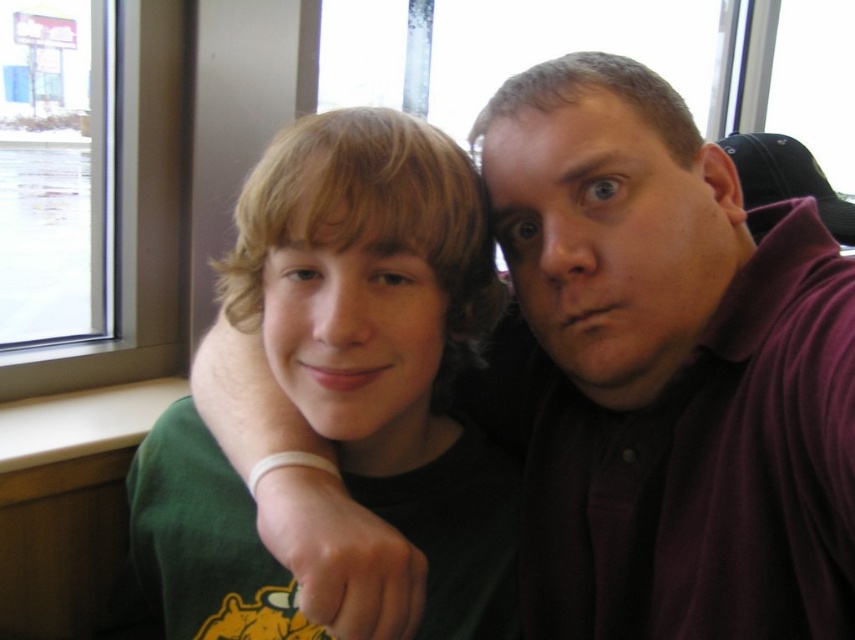
In the scene shown: You are a social distancing enforcer in a public space. You observe two people sitting at point (358, 268). What is the minimum distance you should enforce between them to comply with a 6 feet social distancing guideline?

The minimum distance required for compliance is 6 feet, which is 72 inches. Since the two individuals are only 23.66 inches apart, they are not compliant. Enforce them to move at least 72 inches apart.

You are designing a new clothing line and want to ensure your shirts are appropriately sized. You observe the green matte shirt at center and the transparent glass window at upper left in the image. Which object has a larger surface area?

→ The green matte shirt at center has a larger surface area than the transparent glass window at upper left according to the description.